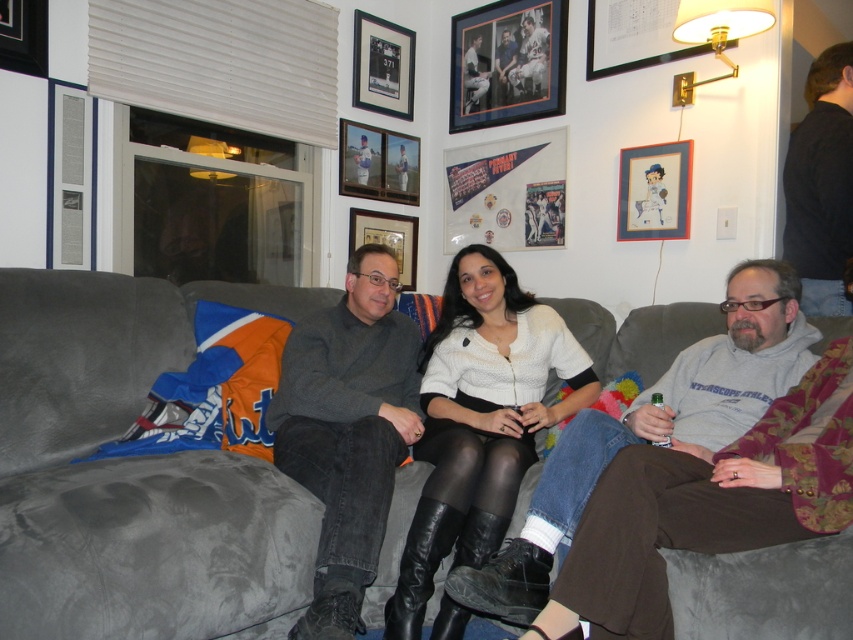
Question: Is black fabric shirt at upper right above wooden framed picture at upper center?

Choices:
 (A) no
 (B) yes

Answer: (A)

Question: Which of these objects is positioned closest to the gray velvety pants at center?

Choices:
 (A) wooden framed picture at upper center
 (B) gray fabric couch at center
 (C) gold metallic picture frame at upper right

Answer: (B)

Question: Based on their relative distances, which object is nearer to the metallic silver picture frame at upper center?

Choices:
 (A) black fabric shirt at upper right
 (B) gray fabric couch at center
 (C) gray velvety pants at center
 (D) wooden betty boop portrait at upper right

Answer: (D)

Question: Can you confirm if white matte sweater at center is positioned to the left of metallic silver picture frame at upper center?

Choices:
 (A) yes
 (B) no

Answer: (B)

Question: Does brushed metal picture frame at upper left come in front of wooden picture frame at center?

Choices:
 (A) no
 (B) yes

Answer: (B)

Question: Which of the following is the closest to the observer?

Choices:
 (A) wooden framed picture at upper center
 (B) gold metallic picture frame at upper right
 (C) wooden betty boop portrait at upper right

Answer: (B)